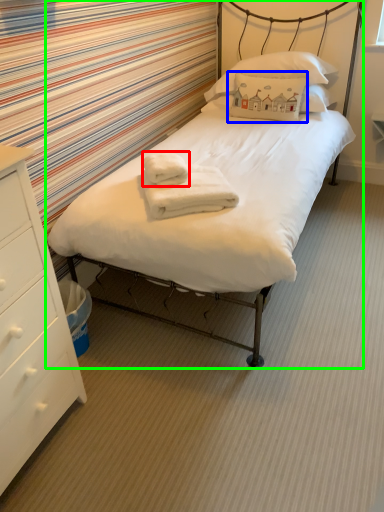
Question: Which object is positioned farthest from bath towel (highlighted by a red box)? Select from pillow (highlighted by a blue box) and bed (highlighted by a green box).

Choices:
 (A) pillow
 (B) bed

Answer: (A)